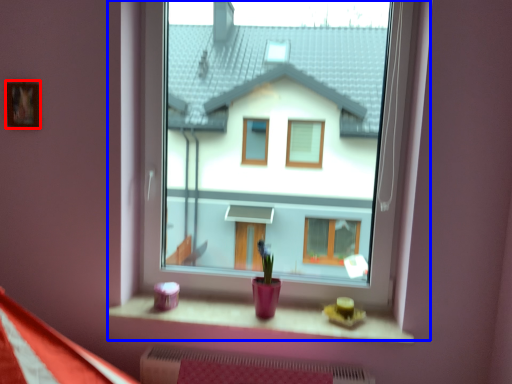
Question: Among these objects, which one is farthest to the camera, picture frame (highlighted by a red box) or window (highlighted by a blue box)?

Choices:
 (A) picture frame
 (B) window

Answer: (A)